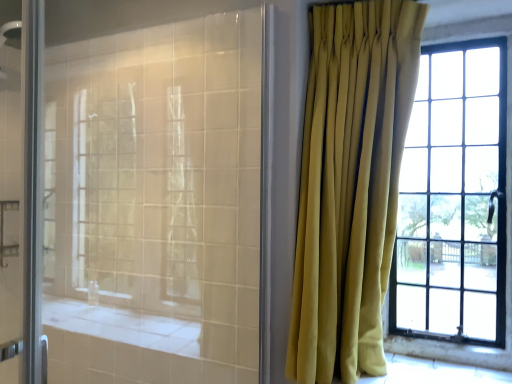
I want to click on translucent glass shower at left, so click(x=155, y=204).

This screenshot has height=384, width=512. What do you see at coordinates (155, 204) in the screenshot?
I see `translucent glass shower at left` at bounding box center [155, 204].

Identify the location of translucent glass shower at left. The width and height of the screenshot is (512, 384). (155, 204).